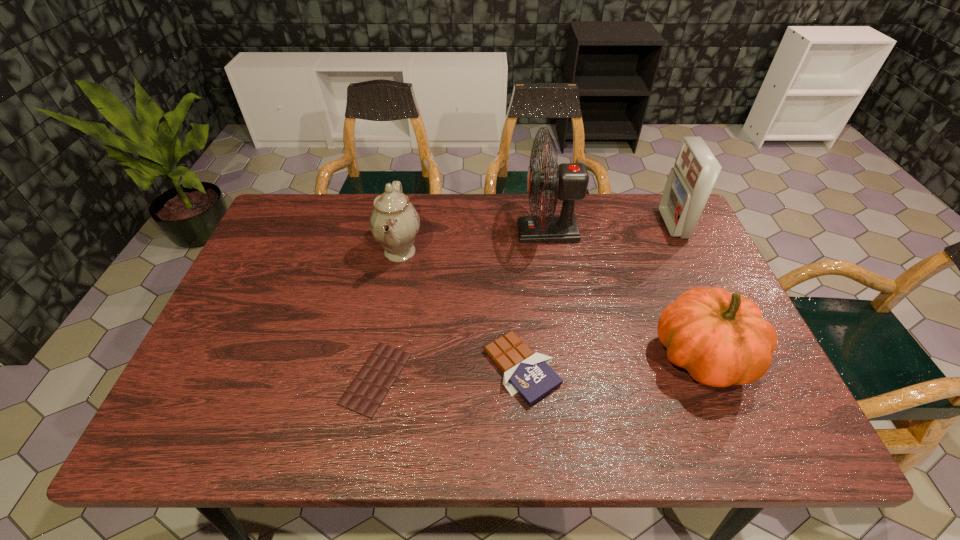
The image size is (960, 540). I want to click on chinaware that is at the far edge, so click(x=394, y=222).

Where is `the first-aid kit that is at the right edge`? the first-aid kit that is at the right edge is located at coordinates (690, 182).

The image size is (960, 540). What are the coordinates of `pumpkin that is at the right edge` in the screenshot? It's located at click(x=720, y=338).

I want to click on object situated at the far right corner, so click(690, 182).

The height and width of the screenshot is (540, 960). In order to click on free space at the far edge of the desktop in this screenshot , I will do `click(595, 211)`.

This screenshot has height=540, width=960. Identify the location of vacant space at the near edge of the desktop. (469, 447).

You are a GUI agent. You are given a task and a screenshot of the screen. Output one action in this format:
    pyautogui.click(x=<x>, y=<y>)
    Task: Click on the vacant area at the left edge
    
    Given the screenshot: What is the action you would take?
    pyautogui.click(x=292, y=255)

At what (x,y) coordinates should I click in order to perform the action: click on vacant space at the right edge. Please return your answer as a coordinate pair (x, y). The height and width of the screenshot is (540, 960). Looking at the image, I should click on (664, 292).

In the image, there is a desktop. Identify the location of vacant space at the near left corner. (176, 449).

In the image, there is a desktop. Identify the location of free region at the far right corner. (x=639, y=232).